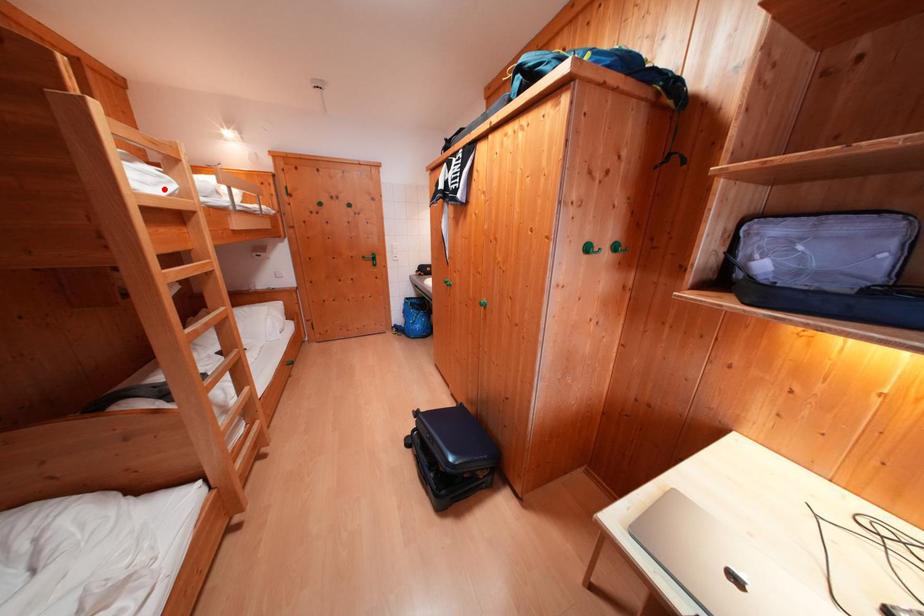
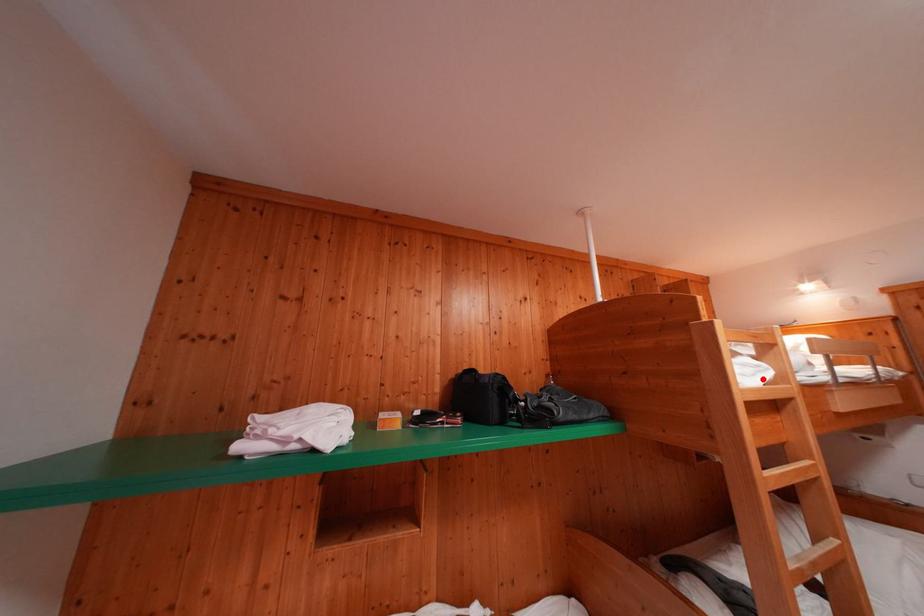
I am providing you with two images of the same scene from different viewpoints. A red point is marked on the first image and another point is marked on the second image. Is the red point in image1 aligned with the point shown in image2?

Yes